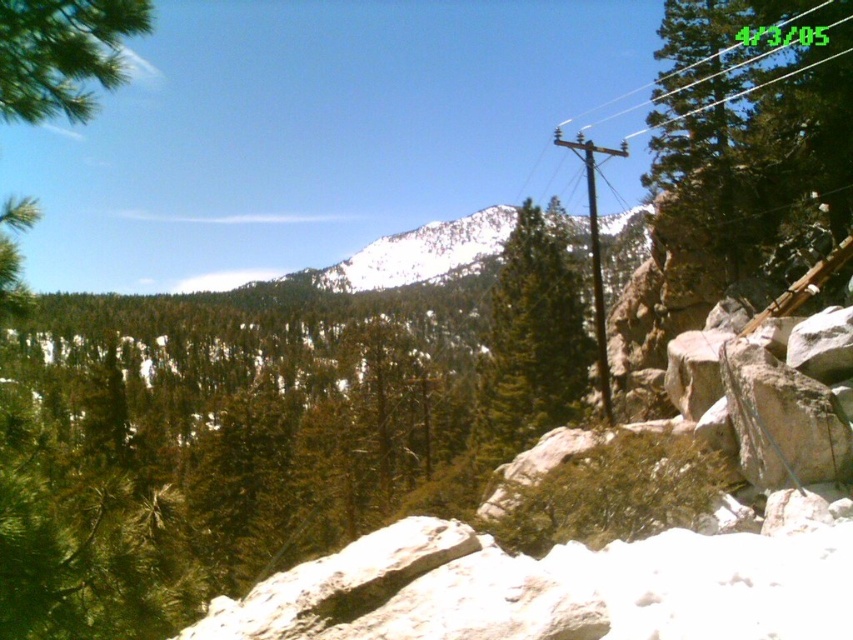
Between snowy white mountain at center and black plastic power line at upper right, which one is positioned higher?

black plastic power line at upper right

The height and width of the screenshot is (640, 853). What are the coordinates of `snowy white mountain at center` in the screenshot? It's located at (418, 253).

Measure the distance between point (397, 244) and camera.

The distance of point (397, 244) from camera is 328.82 meters.

At what (x,y) coordinates should I click in order to perform the action: click on snowy white mountain at center. Please return your answer as a coordinate pair (x, y). The height and width of the screenshot is (640, 853). Looking at the image, I should click on (418, 253).

Is green textured pine tree at center positioned in front of black plastic power line at upper right?

No.

Is green textured pine tree at center wider than black plastic power line at upper right?

In fact, green textured pine tree at center might be narrower than black plastic power line at upper right.

Identify the location of green textured pine tree at center. Image resolution: width=853 pixels, height=640 pixels. (531, 346).

Which is above, black plastic power line at upper right or brown wooden telegraph pole at center-right?

black plastic power line at upper right is above.

Identify the location of black plastic power line at upper right. The height and width of the screenshot is (640, 853). (621, 157).

Between point (798, 12) and point (595, 317), which one is positioned behind?

Point (595, 317)

Where is `black plastic power line at upper right`? black plastic power line at upper right is located at coordinates (621, 157).